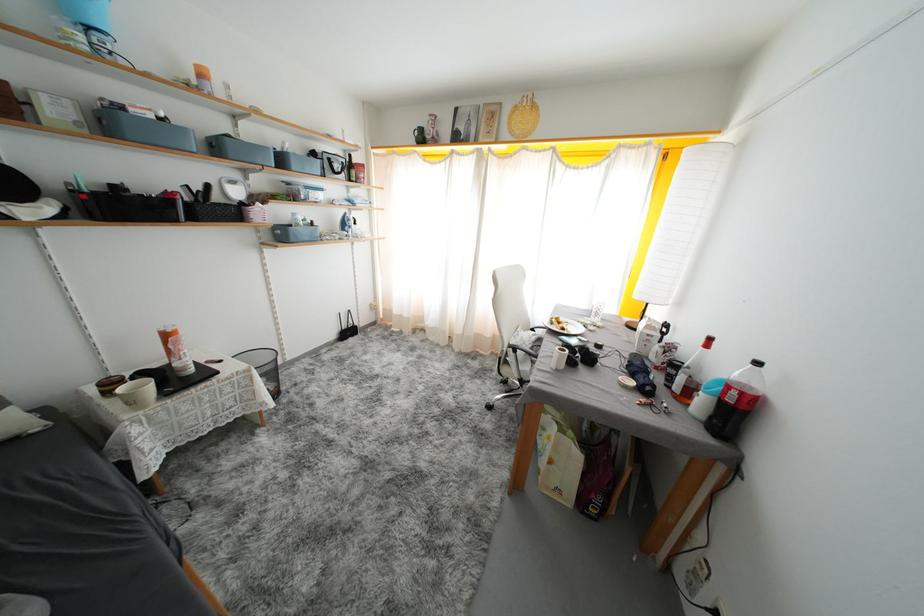
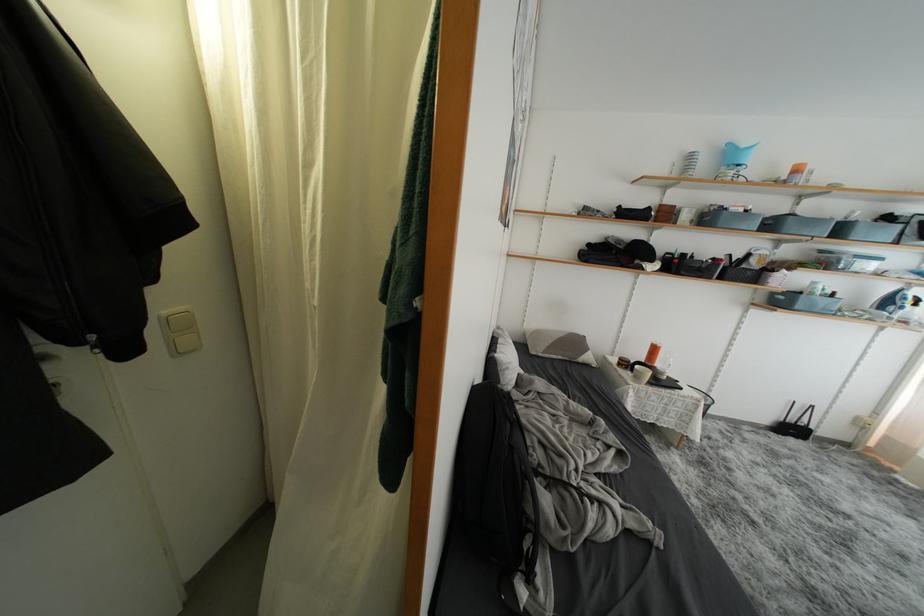
The point at (74, 107) is marked in the first image. Where is the corresponding point in the second image?

(700, 215)